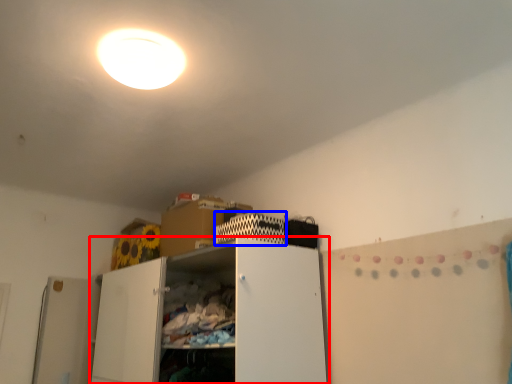
Question: Among these objects, which one is farthest to the camera, cabinetry (highlighted by a red box) or cabinet (highlighted by a blue box)?

Choices:
 (A) cabinetry
 (B) cabinet

Answer: (B)